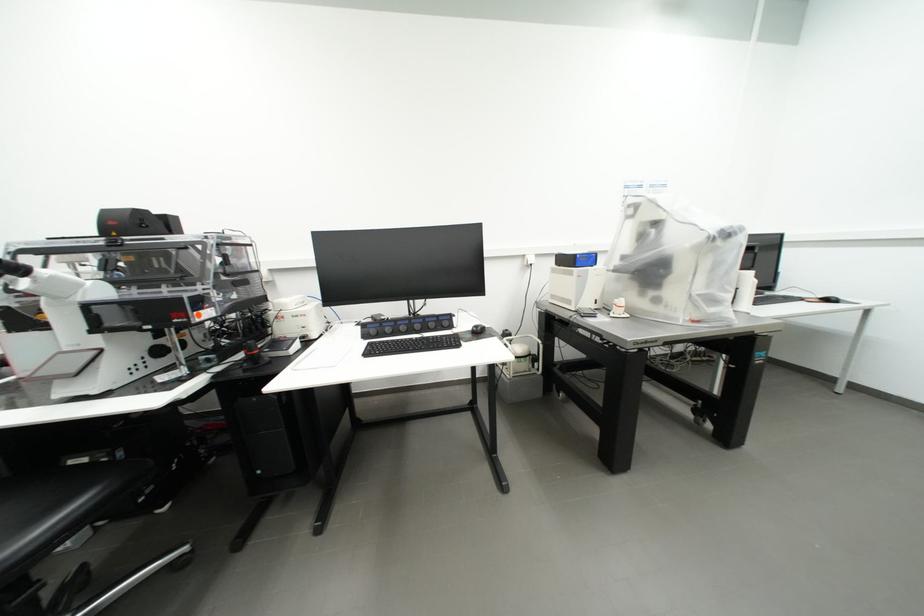
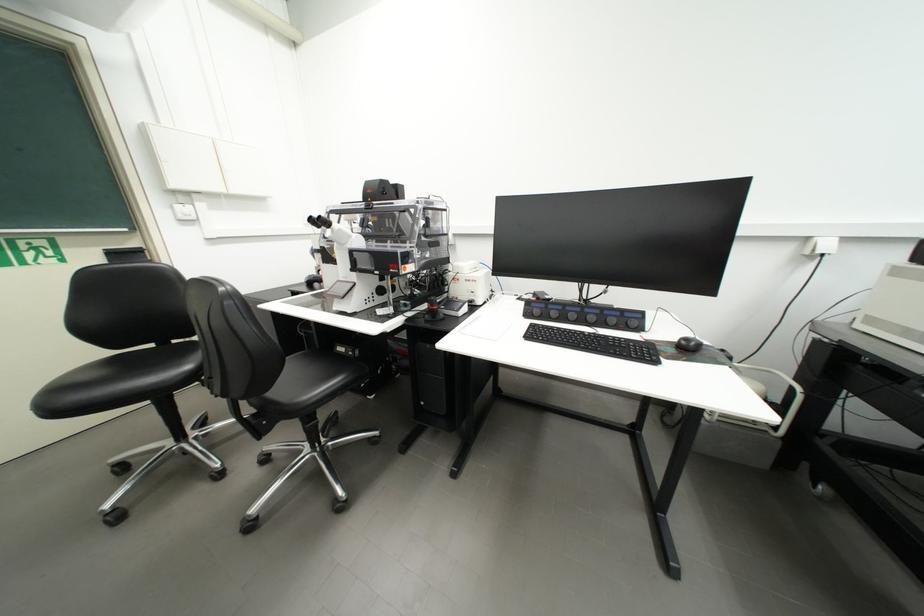
The point at (487, 334) is marked in the first image. Where is the corresponding point in the second image?

(697, 351)